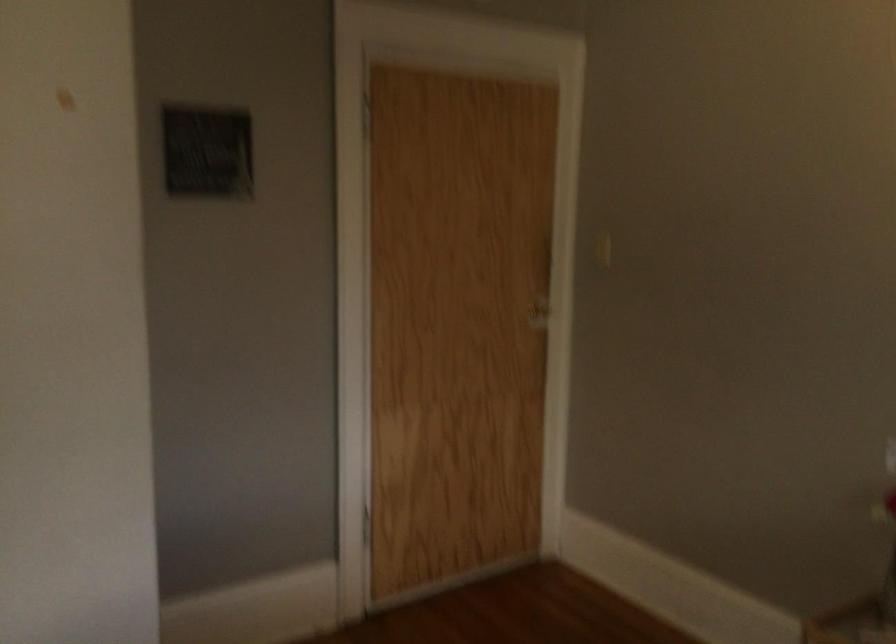
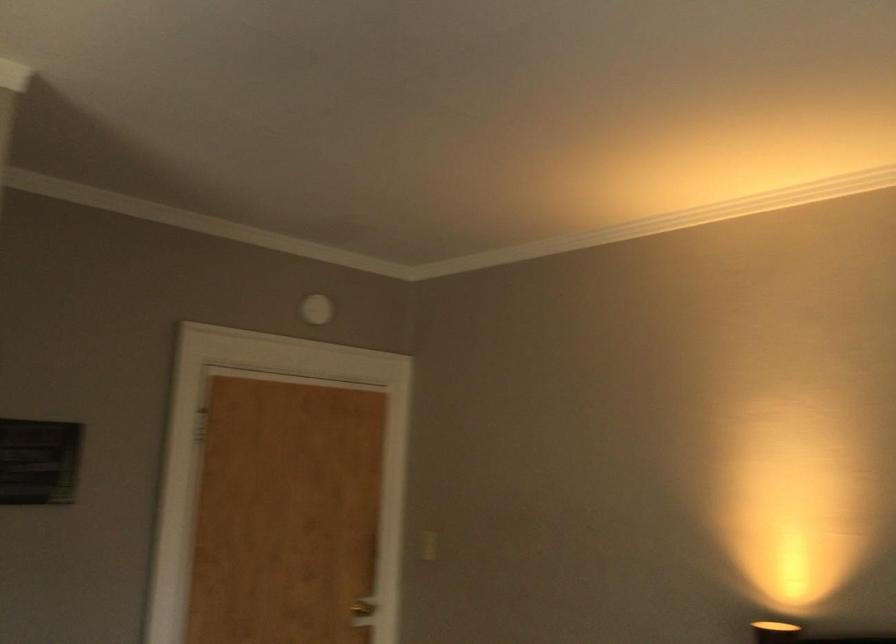
Find the pixel in the second image that matches pixel 600 252 in the first image.

(427, 545)